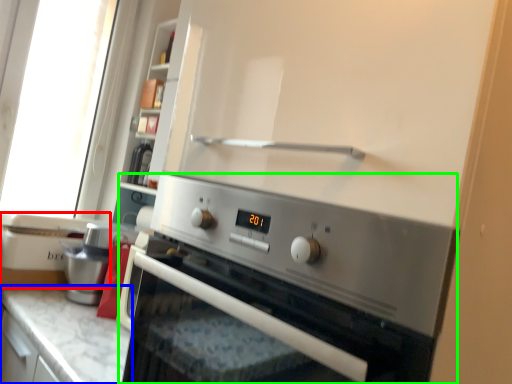
Question: Based on their relative distances, which object is nearer to appliance (highlighted by a red box)? Choose from countertop (highlighted by a blue box) and home appliance (highlighted by a green box).

Choices:
 (A) countertop
 (B) home appliance

Answer: (A)